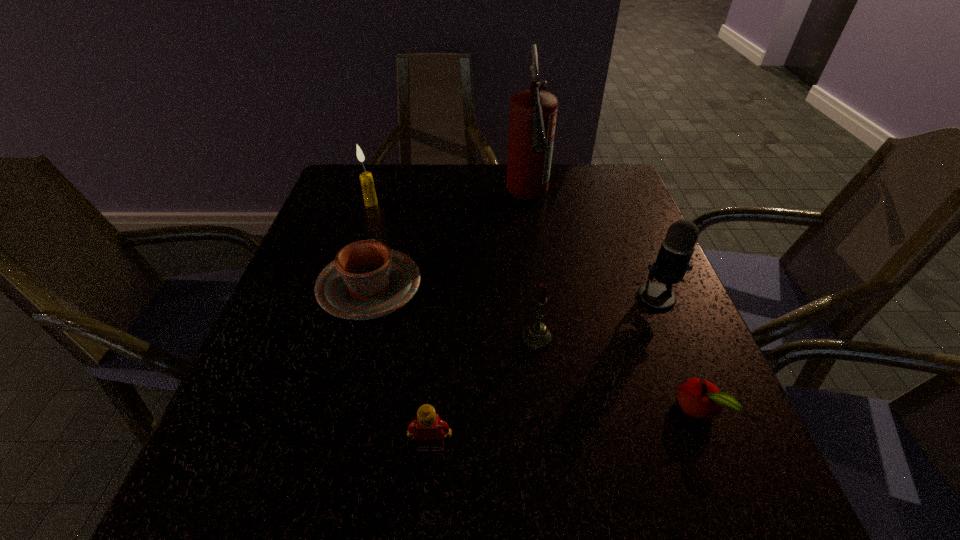
Locate an element on the screen. This screenshot has height=540, width=960. vacant space at the far left corner of the desktop is located at coordinates (383, 200).

Where is `free space between the farther candle and the fire extinguisher`? Image resolution: width=960 pixels, height=540 pixels. free space between the farther candle and the fire extinguisher is located at coordinates [449, 201].

Identify the location of empty space between the nearest object and the apple. (564, 428).

The width and height of the screenshot is (960, 540). Find the location of `empty location between the sixth tallest object and the third nearest object`. empty location between the sixth tallest object and the third nearest object is located at coordinates (453, 313).

Where is `vacant area that lies between the apple and the nearest object`? Image resolution: width=960 pixels, height=540 pixels. vacant area that lies between the apple and the nearest object is located at coordinates (564, 428).

In order to click on free space between the sixth tallest object and the tallest object in this screenshot , I will do `click(448, 244)`.

Identify the location of unoccupied area between the third nearest object and the sixth tallest object. The height and width of the screenshot is (540, 960). (453, 313).

The width and height of the screenshot is (960, 540). In order to click on free area in between the fifth object from right to left and the tallest object in this screenshot , I will do `click(479, 323)`.

Where is `vacant region between the farther candle and the tallest object`? vacant region between the farther candle and the tallest object is located at coordinates (449, 201).

Select which object is the closest to the chinaware. Please provide its 2D coordinates. Your answer should be formatted as a tuple, i.e. [(x, y)], where the tuple contains the x and y coordinates of a point satisfying the conditions above.

[(366, 179)]